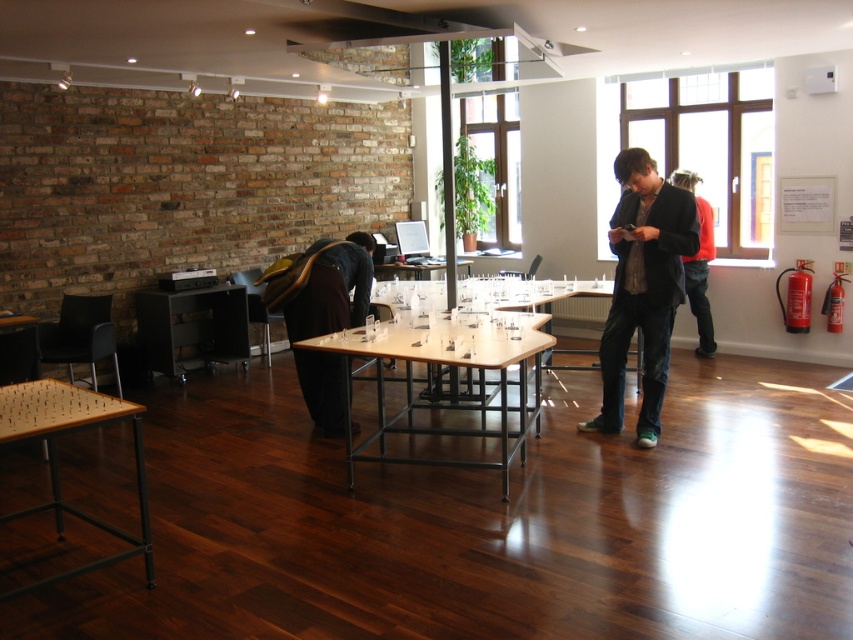
Question: Which point appears closest to the camera in this image?

Choices:
 (A) (343, 406)
 (B) (28, 381)

Answer: (B)

Question: Is wooden table at lower left to the right of black matte table at center from the viewer's perspective?

Choices:
 (A) no
 (B) yes

Answer: (B)

Question: Which of the following is the closest to the observer?

Choices:
 (A) black matte table at center
 (B) matte black jacket at center
 (C) wooden table at lower left
 (D) clear plastic table at center

Answer: (C)

Question: Is wooden table at lower left positioned behind clear plastic table at center?

Choices:
 (A) no
 (B) yes

Answer: (A)

Question: Does black matte table at center have a greater width compared to dark brown leather jacket at center?

Choices:
 (A) no
 (B) yes

Answer: (B)

Question: Which of the following is the farthest from the observer?

Choices:
 (A) clear plastic table at center
 (B) matte black jacket at center

Answer: (A)